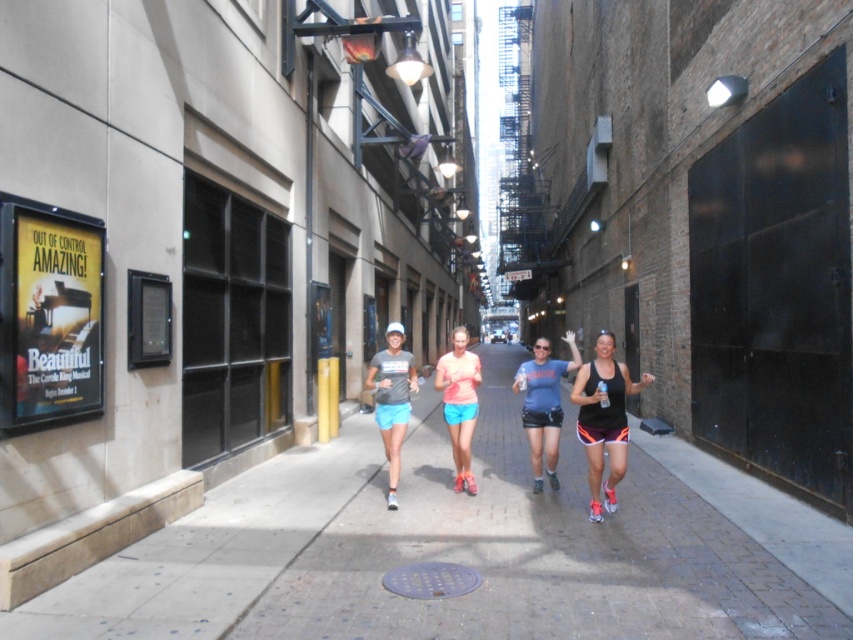
Question: Does brick pavement at center lie behind matte gray t-shirt at center?

Choices:
 (A) no
 (B) yes

Answer: (A)

Question: Estimate the real-world distances between objects in this image. Which object is closer to the brick pavement at center?

Choices:
 (A) blue fabric shorts at center
 (B) black matte tank top at right

Answer: (A)

Question: Is brick pavement at center thinner than matte coral tank top at center?

Choices:
 (A) no
 (B) yes

Answer: (A)

Question: Among these objects, which one is nearest to the camera?

Choices:
 (A) matte gray t-shirt at center
 (B) blue fabric shorts at center

Answer: (B)

Question: Which object is farther from the camera taking this photo?

Choices:
 (A) brick pavement at center
 (B) matte gray t-shirt at center
 (C) black matte tank top at right

Answer: (B)

Question: Does brick pavement at center have a lesser width compared to black matte tank top at right?

Choices:
 (A) no
 (B) yes

Answer: (A)